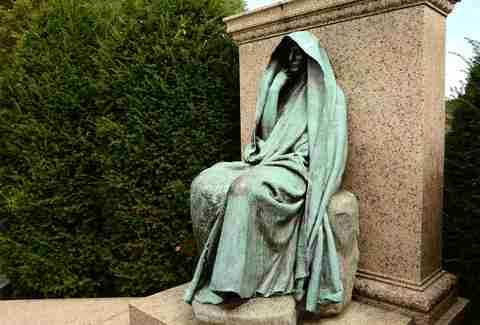
Identify the location of book. Image resolution: width=480 pixels, height=325 pixels. (254, 140).